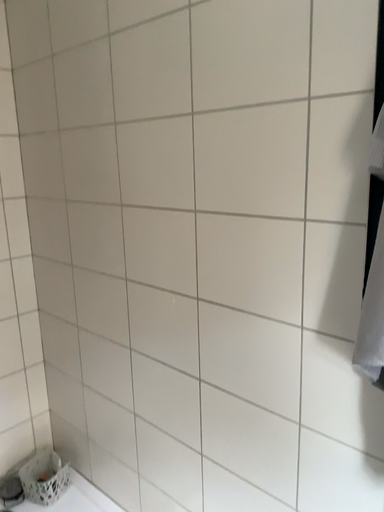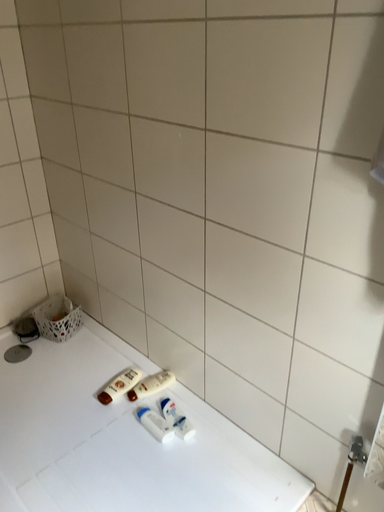
Question: Which way did the camera rotate in the video?

Choices:
 (A) rotated downward
 (B) rotated upward

Answer: (A)